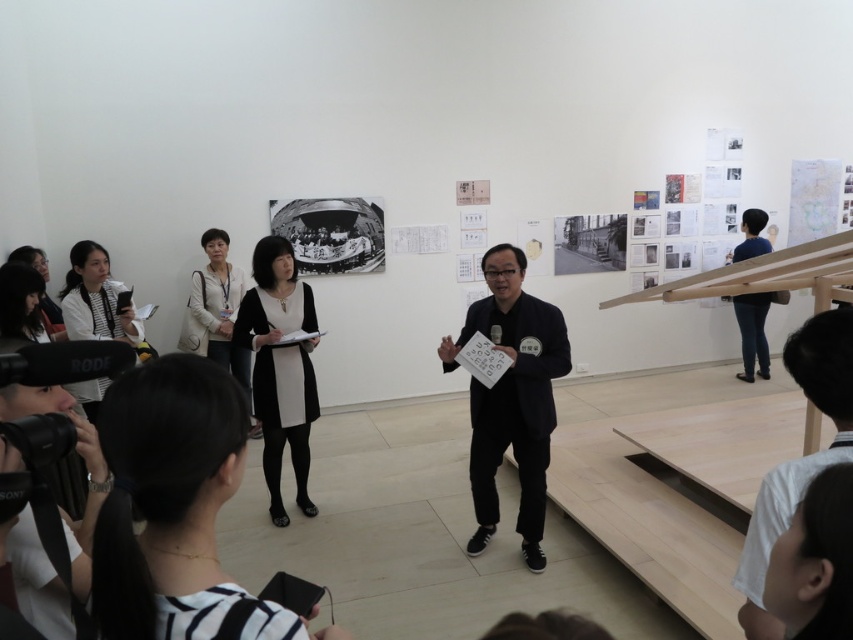
Which is more to the right, light beige sweater at center or blue jeans at right?

From the viewer's perspective, blue jeans at right appears more on the right side.

Which of these two, light beige sweater at center or blue jeans at right, stands shorter?

blue jeans at right

Locate an element on the screen. light beige sweater at center is located at coordinates (216, 308).

Who is higher up, black matte dress at center or black matte shirt at center?

black matte shirt at center is higher up.

Can you confirm if black matte dress at center is positioned to the right of black matte shirt at center?

In fact, black matte dress at center is to the left of black matte shirt at center.

Is point (281, 256) positioned after point (763, 636)?

Yes.

Identify the location of black matte dress at center. This screenshot has width=853, height=640. (280, 365).

Does point (523, 321) come behind point (100, 250)?

No, it is not.

Find the location of `black matte suit at center`. black matte suit at center is located at coordinates (511, 397).